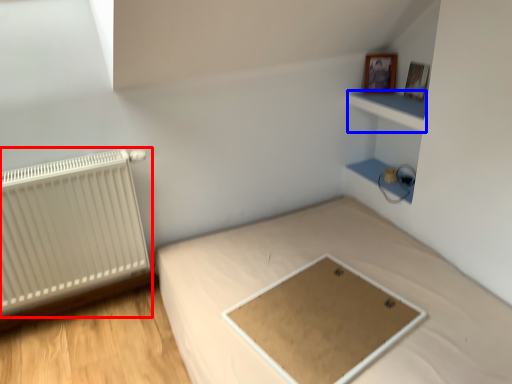
Question: Which object is further to the camera taking this photo, radiator (highlighted by a red box) or cabinet (highlighted by a blue box)?

Choices:
 (A) radiator
 (B) cabinet

Answer: (B)